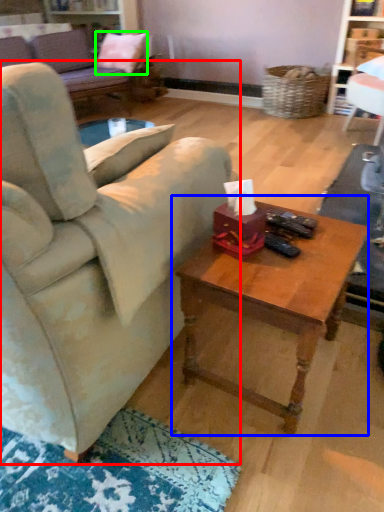
Question: Which object is the farthest from studio couch (highlighted by a red box)? Choose among these: coffee table (highlighted by a blue box) or pillow (highlighted by a green box).

Choices:
 (A) coffee table
 (B) pillow

Answer: (B)